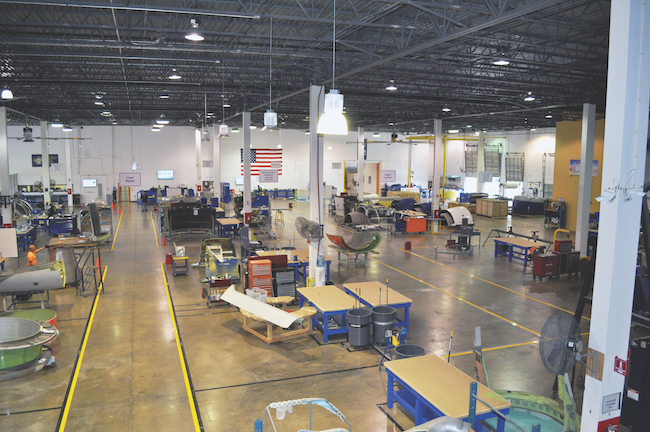
The height and width of the screenshot is (432, 650). Find the location of `table`. table is located at coordinates (320, 298), (363, 288).